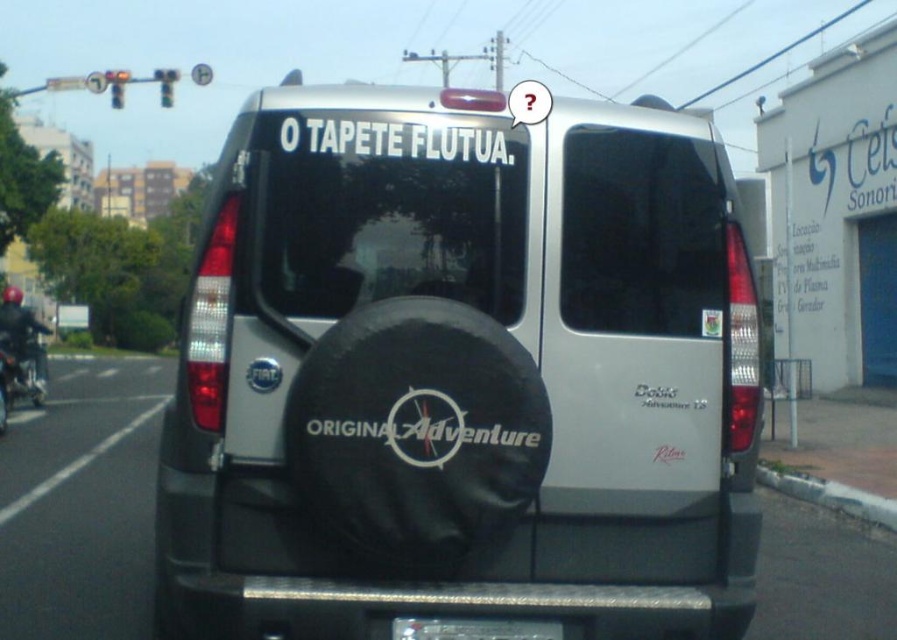
Does black leather helmet at left appear on the right side of white matte sticker at center?

In fact, black leather helmet at left is to the left of white matte sticker at center.

Between point (27, 356) and point (523, 100), which one is positioned in front?

Point (523, 100) is more forward.

Between point (35, 337) and point (512, 120), which one is positioned in front?

Point (512, 120) is more forward.

The width and height of the screenshot is (897, 640). What are the coordinates of `black leather helmet at left` in the screenshot? It's located at (22, 333).

How distant is white plastic license plate at center from white matte sticker at center?

white plastic license plate at center and white matte sticker at center are 8.46 feet apart from each other.

This screenshot has height=640, width=897. What do you see at coordinates (473, 628) in the screenshot? I see `white plastic license plate at center` at bounding box center [473, 628].

Between point (516, 637) and point (537, 84), which one is positioned in front?

Positioned in front is point (516, 637).

Locate an element on the screen. This screenshot has width=897, height=640. white plastic license plate at center is located at coordinates (473, 628).

Does white matte sticker at center appear on the left side of metallic silver traffic light at upper center?

No, white matte sticker at center is not to the left of metallic silver traffic light at upper center.

Who is positioned more to the right, white matte sticker at center or metallic silver traffic light at upper center?

Positioned to the right is white matte sticker at center.

The image size is (897, 640). Identify the location of white matte sticker at center. (528, 102).